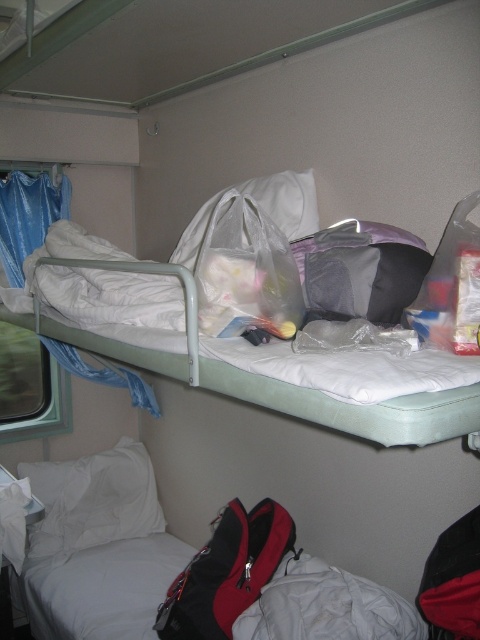
You are packing for a trip and need to choose a storage option between the white fabric mattress at lower left and the translucent plastic bag at upper right. Which one can hold more items?

The white fabric mattress at lower left is bigger than the translucent plastic bag at upper right, so it can hold more items.